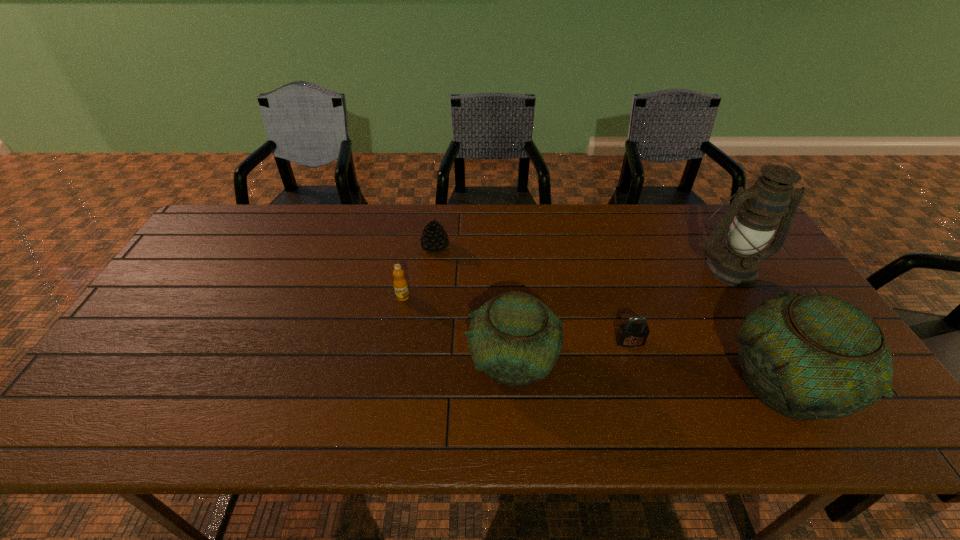
Identify the location of vacant space located on the back of the right pottery. The width and height of the screenshot is (960, 540). (730, 288).

You are a GUI agent. You are given a task and a screenshot of the screen. Output one action in this format:
    pyautogui.click(x=<x>, y=<y>)
    Task: Click on the free location located on the back of the oil lamp
    The image size is (960, 540).
    Given the screenshot: What is the action you would take?
    pyautogui.click(x=702, y=221)

Locate an element on the screen. The width and height of the screenshot is (960, 540). free location located at the narrow end of the pinecone is located at coordinates (524, 247).

Image resolution: width=960 pixels, height=540 pixels. I want to click on free space located on the front label of the fourth nearest object, so (x=397, y=327).

This screenshot has width=960, height=540. I want to click on vacant space located 0.050m on the front of the padlock near the keyhole, so click(x=636, y=364).

Find the location of a particular element. The height and width of the screenshot is (540, 960). object positioned at the far edge is located at coordinates (434, 239).

Find the location of a particular element. The height and width of the screenshot is (540, 960). pottery that is at the right edge is located at coordinates (812, 356).

The height and width of the screenshot is (540, 960). In order to click on oil lamp present at the right edge in this screenshot , I will do `click(758, 209)`.

Find the location of a particular element. The width and height of the screenshot is (960, 540). object present at the near right corner is located at coordinates (812, 356).

Where is `vacant area at the far edge of the desktop`? vacant area at the far edge of the desktop is located at coordinates (489, 207).